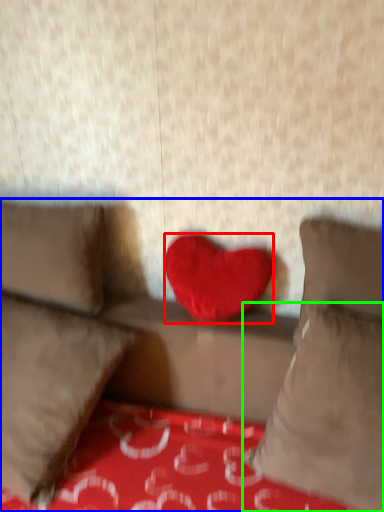
Question: Which is nearer to the heart (highlighted by a red box)? studio couch (highlighted by a blue box) or pillow (highlighted by a green box).

Choices:
 (A) studio couch
 (B) pillow

Answer: (A)